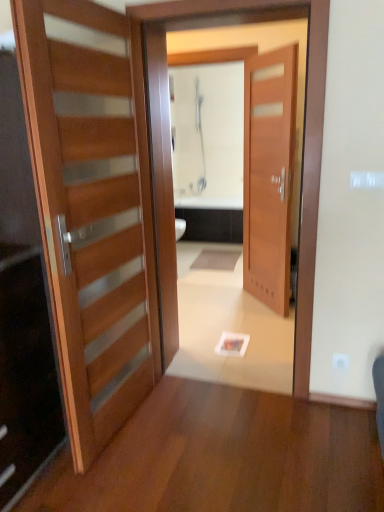
Question: From the image's perspective, is wooden door at center, positioned as the 1th door in right-to-left order, under wooden door at left, which is the 2th door from back to front?

Choices:
 (A) yes
 (B) no

Answer: (B)

Question: From the image's perspective, would you say wooden door at center, positioned as the 1th door in right-to-left order, is positioned over wooden door at left, which ranks as the 2th door in right-to-left order?

Choices:
 (A) yes
 (B) no

Answer: (A)

Question: Is wooden door at center, acting as the 2th door starting from the left, next to wooden door at left, which ranks as the 2th door in right-to-left order, and touching it?

Choices:
 (A) no
 (B) yes

Answer: (A)

Question: Can you confirm if wooden door at center, acting as the 2th door starting from the left, is thinner than wooden door at left, acting as the 1th door starting from the front?

Choices:
 (A) yes
 (B) no

Answer: (A)

Question: From a real-world perspective, does wooden door at center, which is the 1th door in back-to-front order, stand above wooden door at left, acting as the 1th door starting from the front?

Choices:
 (A) yes
 (B) no

Answer: (A)

Question: Visually, is wooden door at center positioned to the left or to the right of wooden door at left, which is the 2th door from back to front?

Choices:
 (A) left
 (B) right

Answer: (B)

Question: From a real-world perspective, is wooden door at center above or below wooden door at left, which is the 2th door from back to front?

Choices:
 (A) below
 (B) above

Answer: (B)

Question: Considering the positions of wooden door at center and wooden door at left, which is the 2th door from back to front, in the image, is wooden door at center bigger or smaller than wooden door at left, which is the 2th door from back to front,?

Choices:
 (A) small
 (B) big

Answer: (B)

Question: Is wooden door at center taller or shorter than wooden door at left, placed as the 1th door when sorted from left to right?

Choices:
 (A) short
 (B) tall

Answer: (B)

Question: In terms of height, does wooden door at left, which is the 2th door from back to front, look taller or shorter compared to wooden door at center?

Choices:
 (A) tall
 (B) short

Answer: (B)

Question: Based on their sizes in the image, would you say wooden door at left, placed as the 1th door when sorted from left to right, is bigger or smaller than wooden door at center?

Choices:
 (A) big
 (B) small

Answer: (B)

Question: From the image's perspective, is wooden door at left, which is the 2th door from back to front, above or below wooden door at center?

Choices:
 (A) below
 (B) above

Answer: (A)

Question: Visually, is wooden door at left, which ranks as the 2th door in right-to-left order, positioned to the left or to the right of wooden door at center?

Choices:
 (A) right
 (B) left

Answer: (B)

Question: Considering the positions of wooden door at center, which is the 1th door in back-to-front order, and wooden door at left, acting as the 1th door starting from the front, in the image, is wooden door at center, which is the 1th door in back-to-front order, taller or shorter than wooden door at left, acting as the 1th door starting from the front,?

Choices:
 (A) short
 (B) tall

Answer: (B)

Question: Would you say wooden door at center, acting as the 2th door starting from the left, is to the left or to the right of wooden door at left, placed as the 1th door when sorted from left to right, in the picture?

Choices:
 (A) left
 (B) right

Answer: (B)